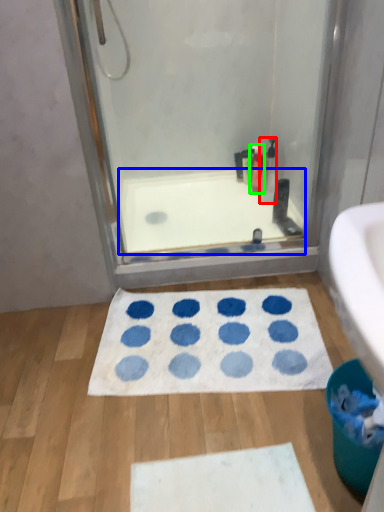
Question: Which is nearer to the cleaning product (highlighted by a red box)? bath (highlighted by a blue box) or cleaning product (highlighted by a green box).

Choices:
 (A) bath
 (B) cleaning product

Answer: (B)